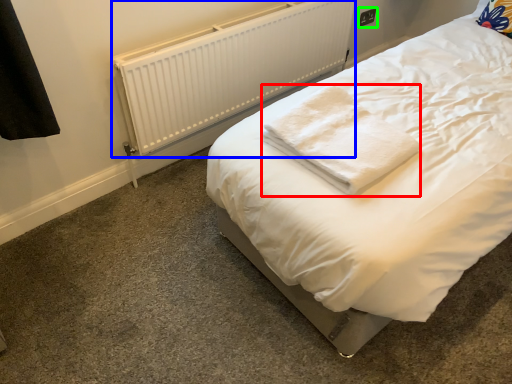
Question: Which object is the farthest from cloth (highlighted by a red box)? Choose among these: radiator (highlighted by a blue box) or electric outlet (highlighted by a green box).

Choices:
 (A) radiator
 (B) electric outlet

Answer: (B)